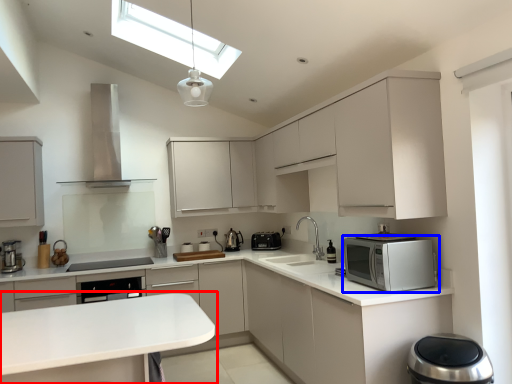
Question: Which point is closer to the camera, countertop (highlighted by a red box) or home appliance (highlighted by a blue box)?

Choices:
 (A) countertop
 (B) home appliance

Answer: (A)